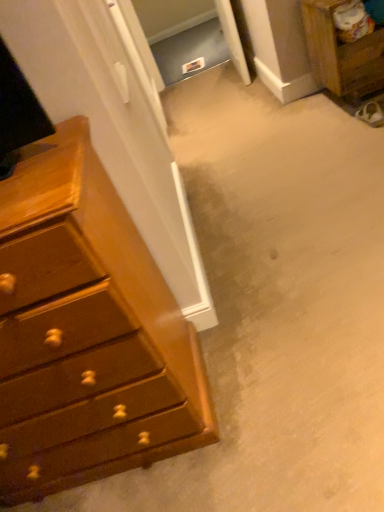
Locate an element on the screen. The image size is (384, 512). wooden nightstand at upper right is located at coordinates (342, 53).

Measure the distance between point (319, 21) and camera.

The distance of point (319, 21) from camera is 7.68 feet.

What is the approximate height of wooden nightstand at upper right?

wooden nightstand at upper right is 24.13 inches tall.

The width and height of the screenshot is (384, 512). What do you see at coordinates (342, 53) in the screenshot?
I see `wooden nightstand at upper right` at bounding box center [342, 53].

Locate an element on the screen. The width and height of the screenshot is (384, 512). shiny brown dresser at left is located at coordinates (86, 332).

The height and width of the screenshot is (512, 384). Describe the element at coordinates (86, 332) in the screenshot. I see `shiny brown dresser at left` at that location.

Locate an element on the screen. The height and width of the screenshot is (512, 384). wooden nightstand at upper right is located at coordinates (342, 53).

Considering the relative positions of shiny brown dresser at left and wooden nightstand at upper right in the image provided, is shiny brown dresser at left to the left of wooden nightstand at upper right from the viewer's perspective?

Yes, shiny brown dresser at left is to the left of wooden nightstand at upper right.

Which is behind, shiny brown dresser at left or wooden nightstand at upper right?

wooden nightstand at upper right is more distant.

Does point (133, 443) come closer to viewer compared to point (365, 65)?

Yes, it is in front of point (365, 65).

From the image's perspective, which object appears higher, shiny brown dresser at left or wooden nightstand at upper right?

wooden nightstand at upper right, from the image's perspective.

Based on the photo, from a real-world perspective, which object rests below the other?

wooden nightstand at upper right is physically lower.

Considering the relative sizes of shiny brown dresser at left and wooden nightstand at upper right in the image provided, is shiny brown dresser at left wider than wooden nightstand at upper right?

Correct, the width of shiny brown dresser at left exceeds that of wooden nightstand at upper right.

Considering the relative sizes of shiny brown dresser at left and wooden nightstand at upper right in the image provided, is shiny brown dresser at left shorter than wooden nightstand at upper right?

Incorrect, the height of shiny brown dresser at left does not fall short of that of wooden nightstand at upper right.

Which of these two, shiny brown dresser at left or wooden nightstand at upper right, is smaller?

wooden nightstand at upper right.

Is shiny brown dresser at left outside of wooden nightstand at upper right?

Yes, shiny brown dresser at left is outside of wooden nightstand at upper right.

Is shiny brown dresser at left directly adjacent to wooden nightstand at upper right?

No, shiny brown dresser at left is not beside wooden nightstand at upper right.

Is shiny brown dresser at left oriented away from wooden nightstand at upper right?

No, shiny brown dresser at left is not facing away from wooden nightstand at upper right.

Can you tell me how much shiny brown dresser at left and wooden nightstand at upper right differ in facing direction?

The angular difference between shiny brown dresser at left and wooden nightstand at upper right is 2.04 degrees.

Where is `chest of drawers below the wooden nightstand at upper right (from the image's perspective)`? The image size is (384, 512). chest of drawers below the wooden nightstand at upper right (from the image's perspective) is located at coordinates (86, 332).

Which is more to the right, wooden nightstand at upper right or shiny brown dresser at left?

wooden nightstand at upper right is more to the right.

Which is in front, wooden nightstand at upper right or shiny brown dresser at left?

shiny brown dresser at left is closer to the camera.

Which point is more distant from viewer, (372, 53) or (23, 201)?

Answer: The point (372, 53) is behind.

From the image's perspective, relative to shiny brown dresser at left, is wooden nightstand at upper right above or below?

wooden nightstand at upper right is situated higher than shiny brown dresser at left in the image.

Consider the image. From a real-world perspective, is wooden nightstand at upper right over shiny brown dresser at left?

No, from a real-world perspective, wooden nightstand at upper right is not on top of shiny brown dresser at left.

Which of these two, wooden nightstand at upper right or shiny brown dresser at left, is thinner?

wooden nightstand at upper right is thinner.

In the scene shown: Considering the relative sizes of wooden nightstand at upper right and shiny brown dresser at left in the image provided, is wooden nightstand at upper right shorter than shiny brown dresser at left?

Correct, wooden nightstand at upper right is not as tall as shiny brown dresser at left.

Between wooden nightstand at upper right and shiny brown dresser at left, which one has smaller size?

With smaller size is wooden nightstand at upper right.

Could shiny brown dresser at left be considered to be inside wooden nightstand at upper right?

No, shiny brown dresser at left is not surrounded by wooden nightstand at upper right.

Can you see wooden nightstand at upper right touching shiny brown dresser at left?

No, wooden nightstand at upper right is not touching shiny brown dresser at left.

Is wooden nightstand at upper right oriented towards shiny brown dresser at left?

No, wooden nightstand at upper right does not turn towards shiny brown dresser at left.

Locate an element on the screen. chest of drawers below the wooden nightstand at upper right (from the image's perspective) is located at coordinates (86, 332).

Where is `the chest of drawers lying in front of the wooden nightstand at upper right`? the chest of drawers lying in front of the wooden nightstand at upper right is located at coordinates (86, 332).

Locate an element on the screen. the chest of drawers below the wooden nightstand at upper right (from the image's perspective) is located at coordinates (86, 332).